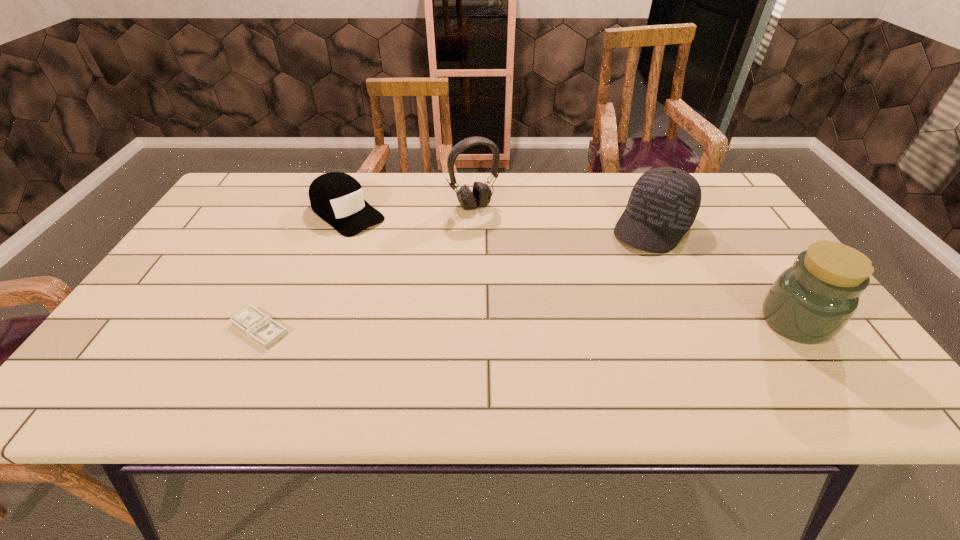
Image resolution: width=960 pixels, height=540 pixels. I want to click on empty space between the jar and the shortest object, so click(x=528, y=325).

The height and width of the screenshot is (540, 960). I want to click on free spot between the shortest object and the jar, so click(x=528, y=325).

Where is `free space between the baseball cap and the rightmost object`? This screenshot has width=960, height=540. free space between the baseball cap and the rightmost object is located at coordinates (724, 274).

In order to click on empty space between the baseball cap and the fourth tallest object in this screenshot , I will do `click(500, 220)`.

What are the coordinates of `free area in between the third object from left to right and the shortest object` in the screenshot? It's located at (367, 267).

Identify the location of free area in between the headset and the rightmost object. Image resolution: width=960 pixels, height=540 pixels. (635, 264).

Find the location of `free space between the shortest object and the rightmost object`. free space between the shortest object and the rightmost object is located at coordinates (528, 325).

Find the location of a particular element. The height and width of the screenshot is (540, 960). free spot between the third shortest object and the jar is located at coordinates (724, 274).

You are a GUI agent. You are given a task and a screenshot of the screen. Output one action in this format:
    pyautogui.click(x=<x>, y=<y>)
    Task: Click on the vacant space that is in between the cap and the jar
    Image resolution: width=960 pixels, height=540 pixels.
    Given the screenshot: What is the action you would take?
    pyautogui.click(x=571, y=268)

Image resolution: width=960 pixels, height=540 pixels. I want to click on object that ranks as the second closest to the money, so click(x=480, y=196).